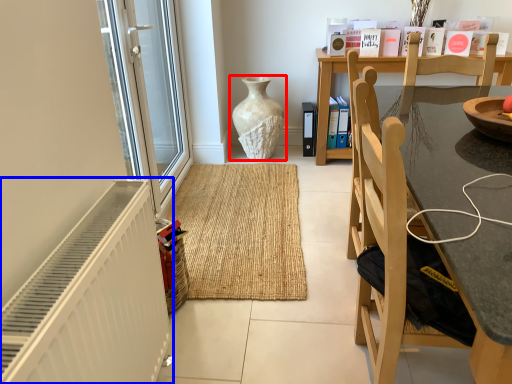
Question: Which of the following is the closest to the observer, vase (highlighted by a red box) or radiator (highlighted by a blue box)?

Choices:
 (A) vase
 (B) radiator

Answer: (B)